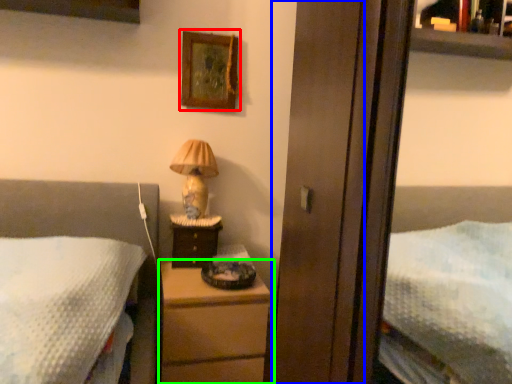
Question: Based on their relative distances, which object is farther from picture frame (highlighted by a red box)? Choose from screen door (highlighted by a blue box) and chest of drawers (highlighted by a green box).

Choices:
 (A) screen door
 (B) chest of drawers

Answer: (A)